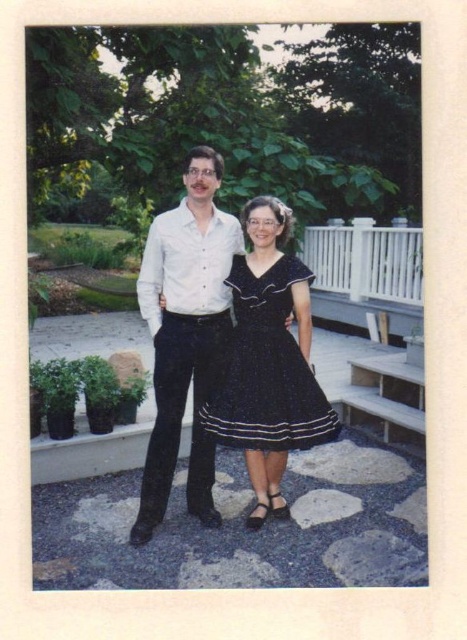
You are a photographer trying to frame a shot of the white glossy shirt at center and the dark blue satin dress at center. Which one should you zoom in on to focus on the narrower object?

The white glossy shirt at center has a smaller width compared to the dark blue satin dress at center, so you should zoom in on the white glossy shirt at center to focus on the narrower object.

You are a photographer adjusting the camera settings to ensure both the white glossy shirt at center and the dark blue satin dress at center are in focus. Based on their positions, which one should you focus on first to capture both clearly?

The white glossy shirt at center is located above the dark blue satin dress at center. To ensure both are in focus, you should focus on the white glossy shirt at center first as it is closer to the camera.